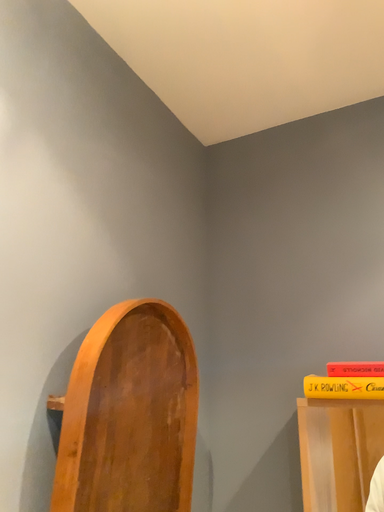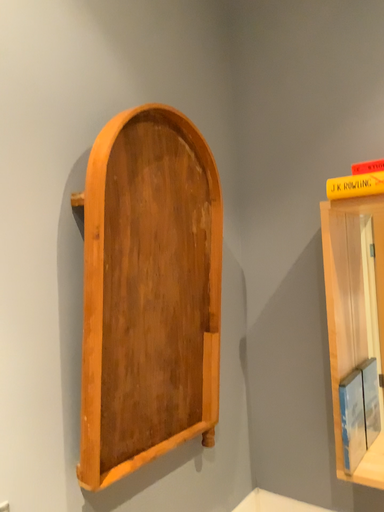
Question: How did the camera likely rotate when shooting the video?

Choices:
 (A) rotated upward
 (B) rotated downward

Answer: (B)